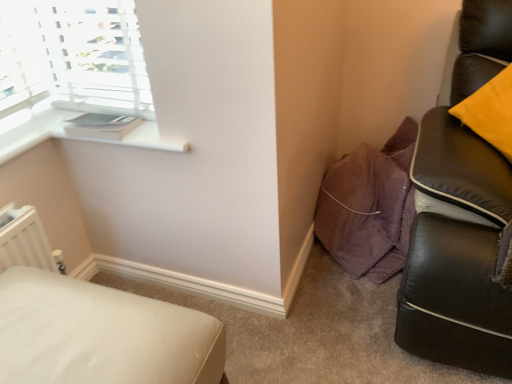
You are a GUI agent. You are given a task and a screenshot of the screen. Output one action in this format:
    pyautogui.click(x=<x>, y=<y>)
    Task: Click on the vacant space situated above white fabric ottoman at lower left (from a real-world perspective)
    This screenshot has width=512, height=384.
    Given the screenshot: What is the action you would take?
    pyautogui.click(x=72, y=336)